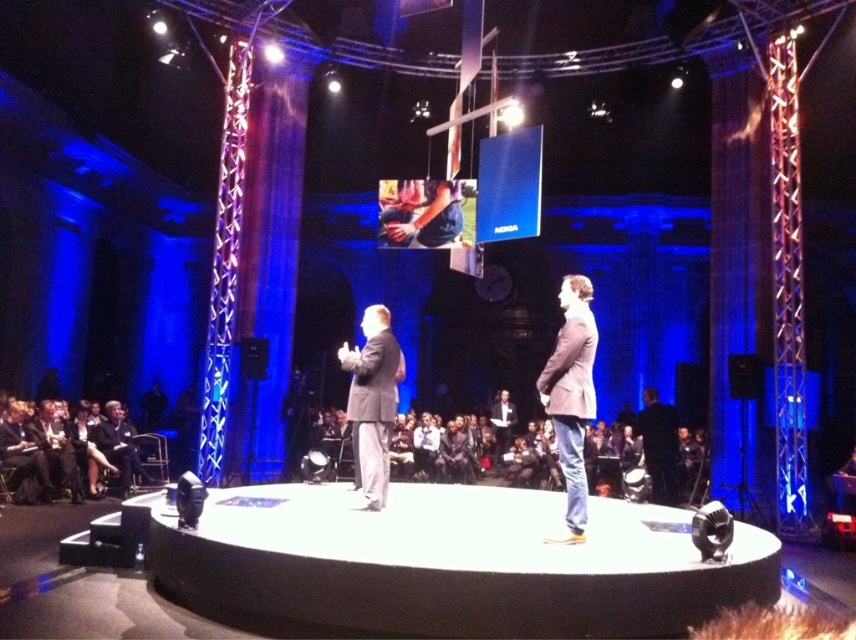
Can you confirm if matte gray suit at center is shorter than denim jacket at center?

No.

Which is below, matte gray suit at center or denim jacket at center?

matte gray suit at center is lower down.

Find the location of a particular element. Image resolution: width=856 pixels, height=640 pixels. matte gray suit at center is located at coordinates (372, 401).

Does white smooth stage at center have a lesser height compared to matte gray suit at center?

Correct, white smooth stage at center is not as tall as matte gray suit at center.

Does white smooth stage at center have a smaller size compared to matte gray suit at center?

Yes, white smooth stage at center is smaller than matte gray suit at center.

Which is in front, point (696, 595) or point (391, 340)?

Point (696, 595) is in front.

Identify the location of white smooth stage at center. The image size is (856, 640). (449, 564).

Does white smooth stage at center have a larger size compared to denim jacket at center?

Actually, white smooth stage at center might be smaller than denim jacket at center.

Who is shorter, white smooth stage at center or denim jacket at center?

white smooth stage at center is shorter.

Locate an element on the screen. The image size is (856, 640). white smooth stage at center is located at coordinates (449, 564).